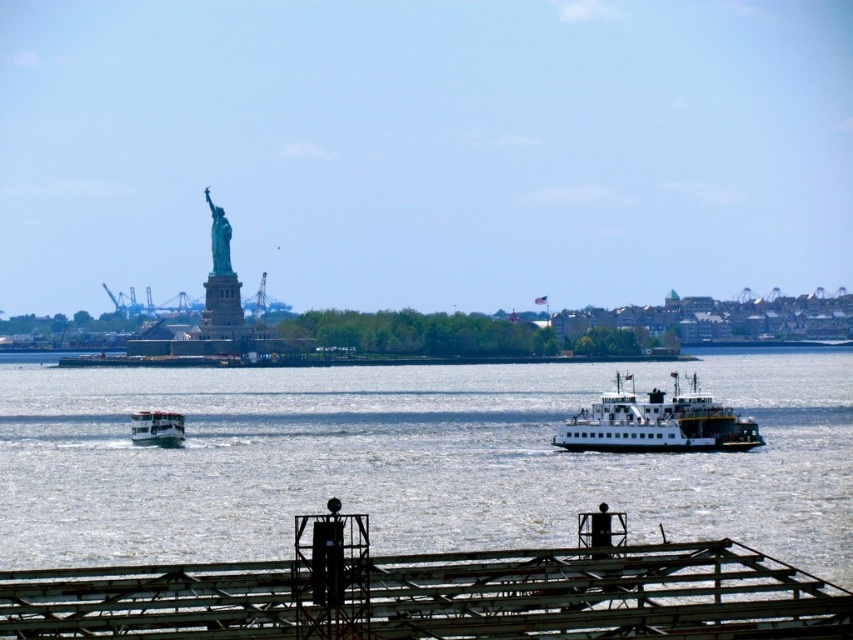
Between gray metallic water at center and white matte ferryboat at center, which one appears on the right side from the viewer's perspective?

From the viewer's perspective, gray metallic water at center appears more on the right side.

Who is higher up, gray metallic water at center or white matte ferryboat at center?

gray metallic water at center is above.

The width and height of the screenshot is (853, 640). What do you see at coordinates (409, 460) in the screenshot?
I see `gray metallic water at center` at bounding box center [409, 460].

Find the location of a particular element. Image resolution: width=853 pixels, height=640 pixels. gray metallic water at center is located at coordinates (409, 460).

Can you confirm if metallic gray dock at lower center is wider than green patina statue at upper left?

Correct, the width of metallic gray dock at lower center exceeds that of green patina statue at upper left.

What do you see at coordinates (437, 593) in the screenshot?
I see `metallic gray dock at lower center` at bounding box center [437, 593].

Does point (360, 516) come behind point (221, 211)?

No, (360, 516) is in front of (221, 211).

I want to click on metallic gray dock at lower center, so click(437, 593).

Between white matte ferry at center and green patina statue at upper left, which one is positioned lower?

Positioned lower is white matte ferry at center.

Who is more distant from viewer, [654,403] or [222,230]?

The point [222,230] is more distant.

Where is `white matte ferry at center`? This screenshot has width=853, height=640. white matte ferry at center is located at coordinates (657, 422).